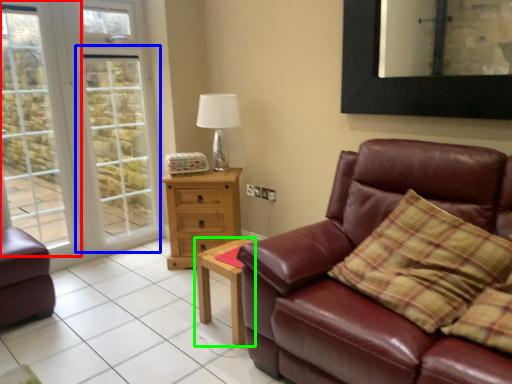
Question: Which object is the closest to the window (highlighted by a red box)? Choose among these: screen door (highlighted by a blue box) or table (highlighted by a green box).

Choices:
 (A) screen door
 (B) table

Answer: (A)